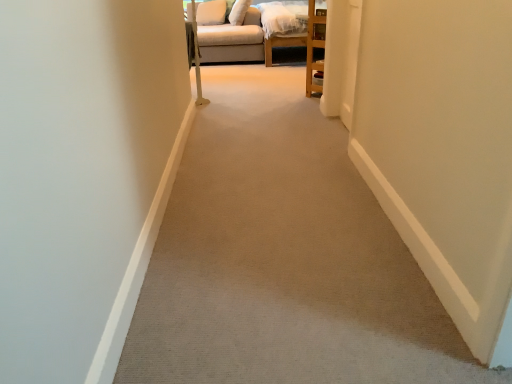
Question: Is beige fabric couch at upper center in front of or behind beige carpet at center in the image?

Choices:
 (A) behind
 (B) front

Answer: (A)

Question: Is point (257, 59) positioned closer to the camera than point (250, 316)?

Choices:
 (A) closer
 (B) farther

Answer: (B)

Question: Which is nearer to the beige carpet at center?

Choices:
 (A) white fabric pillow at upper center, marked as the 1th pillow in a left-to-right arrangement
 (B) beige fabric couch at upper center
 (C) beige fabric pillow at upper center, which is the 1th pillow in right-to-left order

Answer: (B)

Question: Estimate the real-world distances between objects in this image. Which object is farther from the beige fabric pillow at upper center, marked as the 2th pillow in a left-to-right arrangement?

Choices:
 (A) beige fabric couch at upper center
 (B) beige carpet at center
 (C) white fabric pillow at upper center, marked as the 1th pillow in a left-to-right arrangement

Answer: (B)